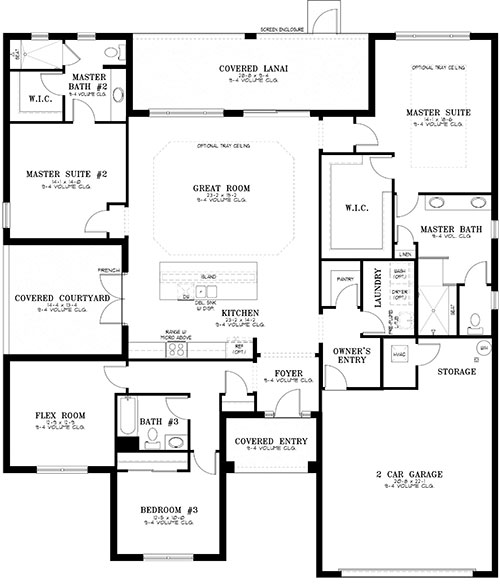
Where is `windows`? The width and height of the screenshot is (500, 584). windows is located at coordinates (64, 471), (167, 557), (496, 298), (495, 232), (435, 36), (194, 110), (40, 34), (84, 34), (8, 213).